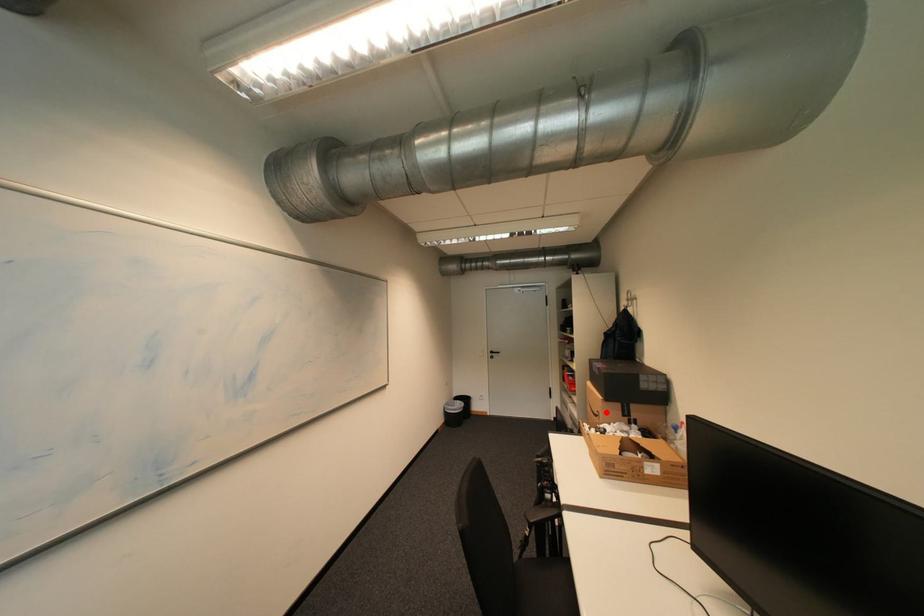
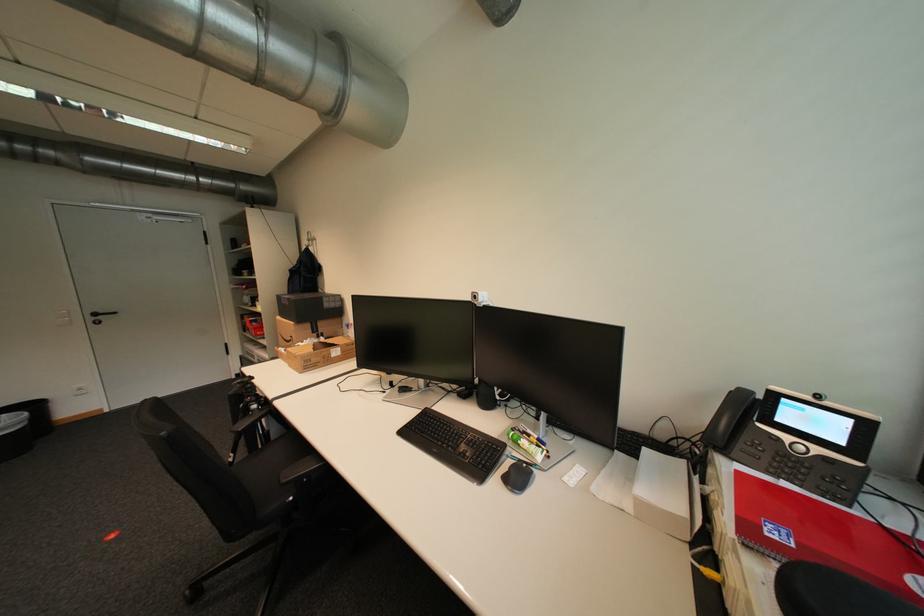
Locate, in the second image, the point that corresponds to the highlighted location in the first image.

(299, 338)